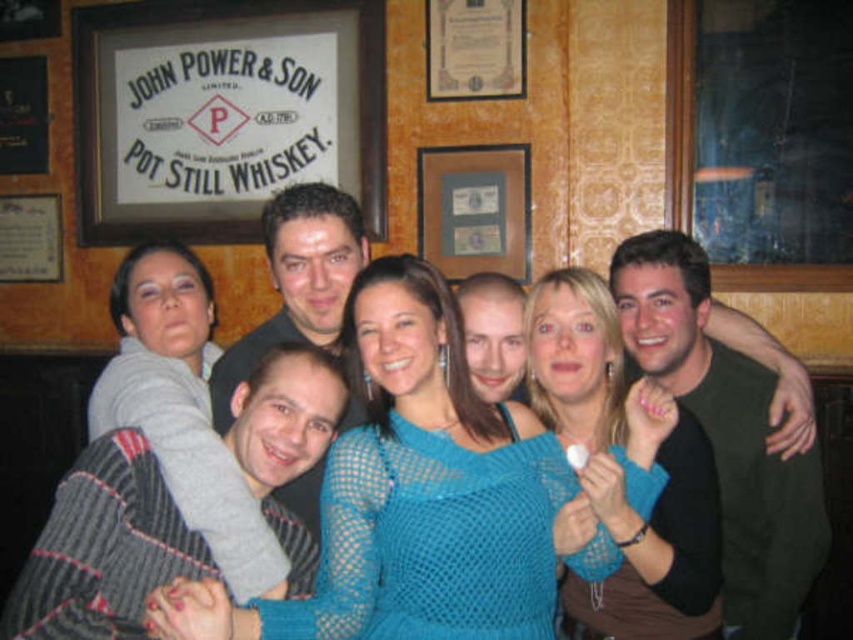
You are a photographer trying to capture a group photo in a bar. You notice a white paper sign at upper left and a blue knitted sweater at center. Which object is wider?

The white paper sign at upper left is wider than the blue knitted sweater at center according to the description.

You are a photographer trying to adjust the group photo so that everyone is visible. The blue knitted sweater at center and the green matte shirt at right are currently overlapping. Which person should you ask to move back slightly to ensure both are visible in the photo?

The green matte shirt at right should move back slightly because the blue knitted sweater at center is currently in front of it, so adjusting the position of the person in the green matte shirt at right would allow both to be visible without overlapping.

You are a photographer trying to adjust the lighting for a group photo. You notice two people wearing knitted teal sweater at center and blue knitted sweater at center. Which sweater is positioned higher in the image?

The knitted teal sweater at center is located above the blue knitted sweater at center, so it is positioned higher in the image.